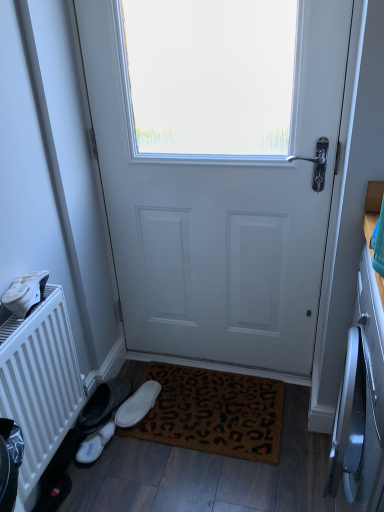
Locate an element on the screen. The width and height of the screenshot is (384, 512). free spot above white suede slipper at lower left, marked as the second footwear in a left-to-right arrangement (from a real-world perspective) is located at coordinates (140, 396).